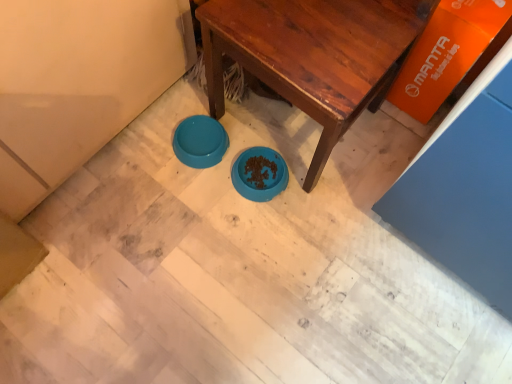
Find the location of `vacant space in teal plastic bowl at center (from a real-world perspective)`. vacant space in teal plastic bowl at center (from a real-world perspective) is located at coordinates (197, 147).